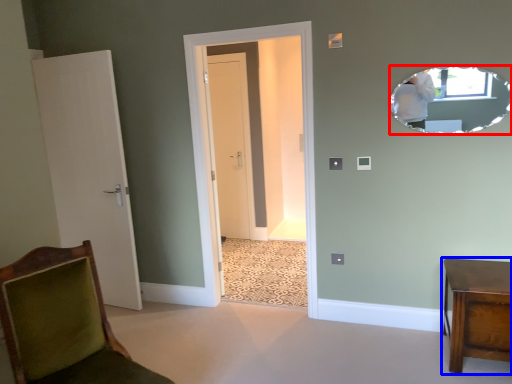
Question: Which point is closer to the camera, mirror (highlighted by a red box) or furniture (highlighted by a blue box)?

Choices:
 (A) mirror
 (B) furniture

Answer: (B)